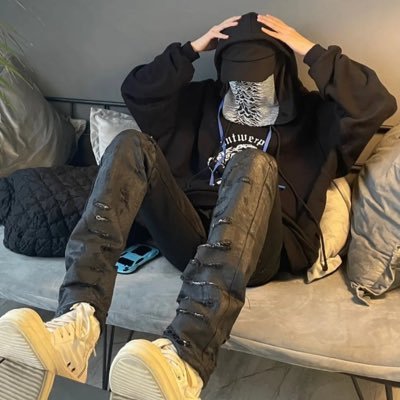
The image size is (400, 400). I want to click on couch, so click(x=294, y=297).